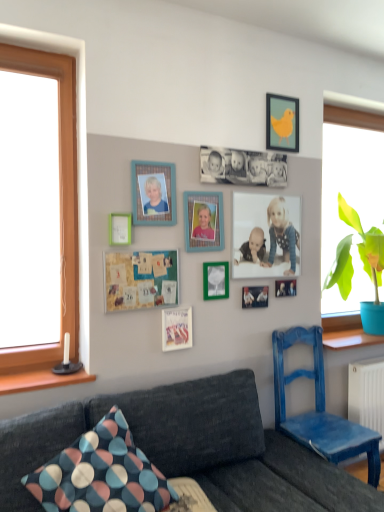
Question: Based on their sizes in the image, would you say green leafy plant in blue pot at right is bigger or smaller than matte black picture frame at center, the 9th picture frame positioned from the top?

Choices:
 (A) big
 (B) small

Answer: (A)

Question: Would you say green leafy plant in blue pot at right is to the left or to the right of matte black picture frame at center, the 9th picture frame positioned from the top, in the picture?

Choices:
 (A) right
 (B) left

Answer: (A)

Question: Which of these objects is positioned farthest from the wooden photo frame at center, the seventh picture frame from the bottom?

Choices:
 (A) green matte picture frame at upper left, arranged as the fifth picture frame when viewed from the top
 (B) green matte picture frame at center, which ranks as the 4th picture frame in bottom-to-top order
 (C) green leafy plant in blue pot at right
 (D) matte blue picture frame at upper left, acting as the eighth picture frame starting from the bottom
 (E) dark gray fabric couch at lower left

Answer: (C)

Question: Based on their relative distances, which object is nearer to the matte yellow bird at upper right, placed as the first picture frame when sorted from top to bottom?

Choices:
 (A) polka dot fabric pillow at lower left
 (B) matte black picture frame at center, placed as the second picture frame when sorted from bottom to top
 (C) green fabric bulletin board at center
 (D) green leafy plant in blue pot at right
 (E) black matte photo frame at center, arranged as the 2th picture frame when viewed from the top

Answer: (E)